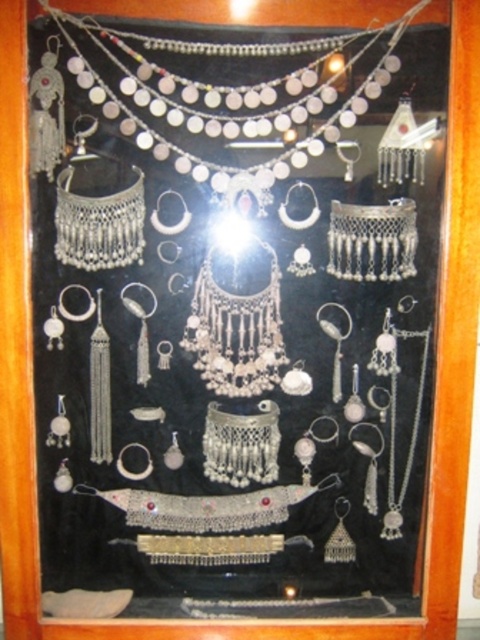
You are a customer looking at the jewelry case. You see the silver metallic necklace at upper center and the silver metallic necklace at center. Which one appears closer to you?

The silver metallic necklace at upper center appears closer because it is in front of the silver metallic necklace at center.

You are standing in front of a jewelry display case. The silver metallic necklace at upper center catches your eye. If you want to see it more clearly, should you move closer or farther away from the display case?

The silver metallic necklace at upper center is 5.62 feet away from you. To see it more clearly, you should move closer to the display case.